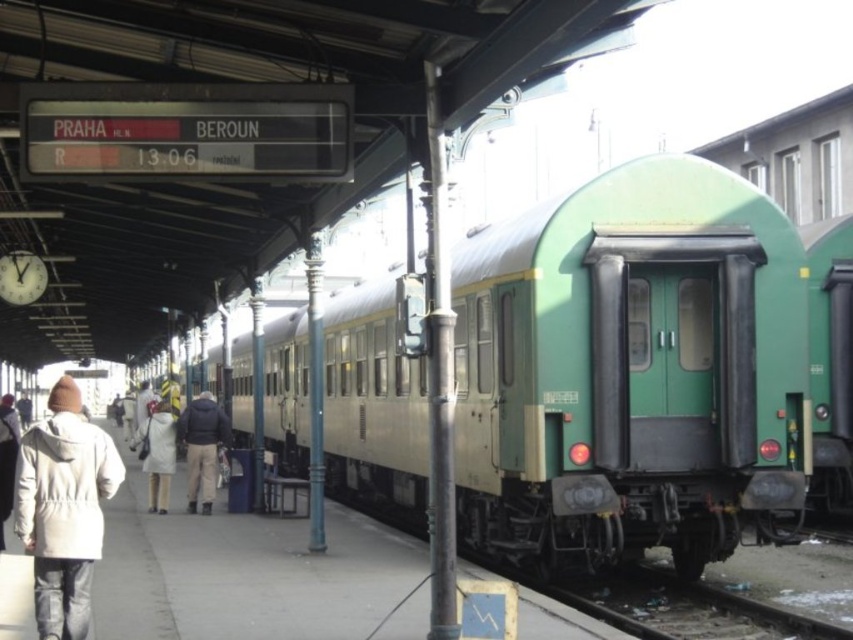
You are standing on the train station platform and see a dark blue jacket at center and a white matte coat at lower left. Which one is shorter in height?

The dark blue jacket at center is shorter in height compared to the white matte coat at lower left.

You are a traveler waiting at the train station platform. You have a white matte coat at left and a white woolen hat at upper left. Which item is closer to you?

The white matte coat at left is closer to you because it is in front of the white woolen hat at upper left.

From the picture: You are a traveler waiting at the train station platform. You see a white matte coat at left and a white woolen hat at upper left. Which item is smaller in size?

The white matte coat at left is smaller in size compared to the white woolen hat at upper left.